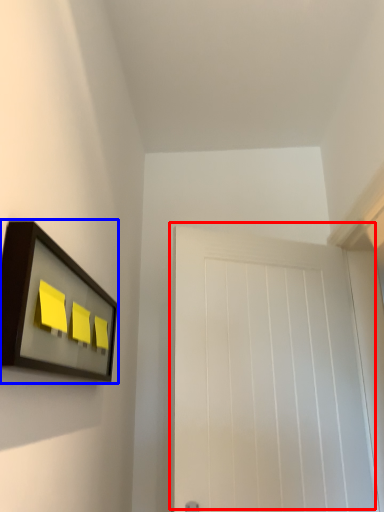
Question: Which point is further to the camera, door (highlighted by a red box) or picture frame (highlighted by a blue box)?

Choices:
 (A) door
 (B) picture frame

Answer: (A)